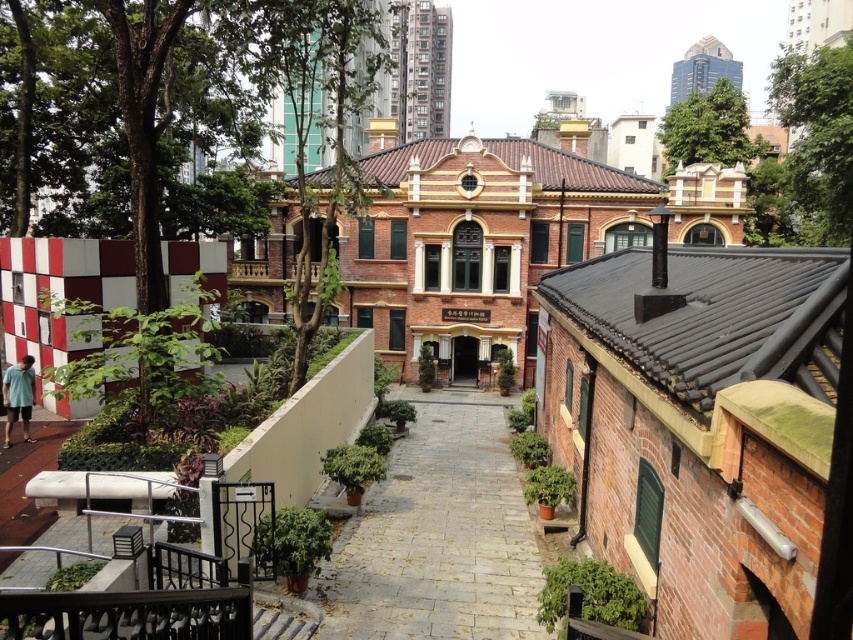
Between gray stone path at center and light blue cotton shirt at lower left, which one has less height?

light blue cotton shirt at lower left is shorter.

In the scene shown: Which is more to the right, gray stone path at center or light blue cotton shirt at lower left?

From the viewer's perspective, gray stone path at center appears more on the right side.

Who is more distant from viewer, (457, 556) or (26, 429)?

The point (26, 429) is more distant.

Where is `gray stone path at center`? The height and width of the screenshot is (640, 853). gray stone path at center is located at coordinates (438, 534).